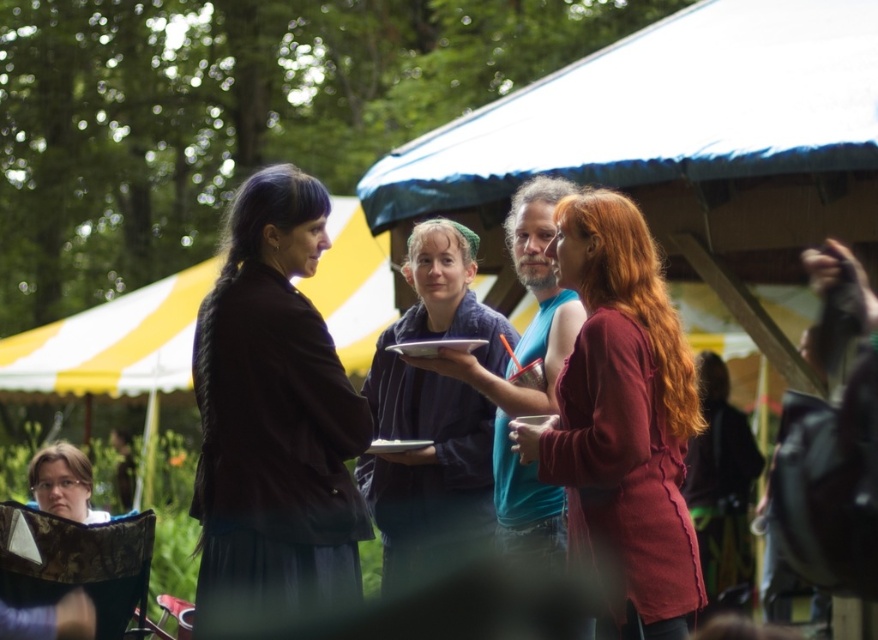
Does maroon knit sweater at center lie in front of blue cotton tank top at center?

Yes, it is.

Does maroon knit sweater at center have a lesser width compared to blue cotton tank top at center?

Correct, maroon knit sweater at center's width is less than blue cotton tank top at center's.

Image resolution: width=878 pixels, height=640 pixels. What are the coordinates of `maroon knit sweater at center` in the screenshot? It's located at (623, 420).

Is matte brown jacket at left closer to the viewer compared to matte black jacket at lower left?

Yes, it is.

From the picture: Who is positioned more to the left, matte brown jacket at left or matte black jacket at lower left?

matte black jacket at lower left

Identify the location of matte brown jacket at left. (274, 416).

Measure the distance between dark blue fabric at center and matte black jacket at lower left.

A distance of 6.69 feet exists between dark blue fabric at center and matte black jacket at lower left.

Is point (378, 413) positioned behind point (44, 488)?

That is False.

Identify the location of dark blue fabric at center. The image size is (878, 640). (432, 413).